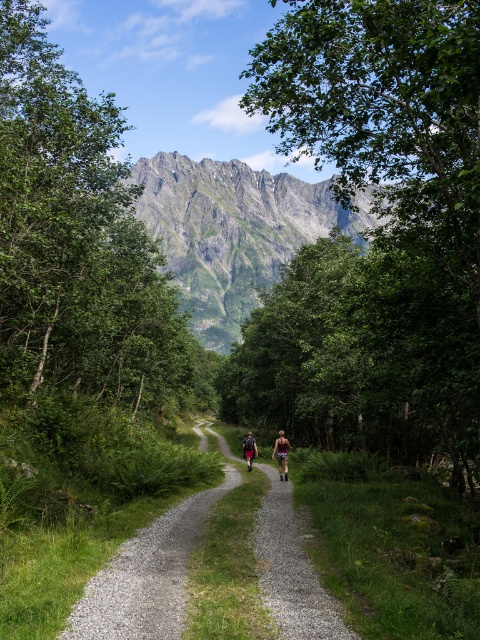
The width and height of the screenshot is (480, 640). What are the coordinates of `gravel path at center` in the screenshot? It's located at (146, 577).

Who is taller, gravel path at center or camouflage fabric shorts at center?

camouflage fabric shorts at center

Which is in front, point (326, 593) or point (272, 456)?

Point (326, 593) is more forward.

I want to click on gravel path at center, so click(146, 577).

Based on the photo, who is taller, green grassy mountain at upper center or camouflage shorts at center?

green grassy mountain at upper center is taller.

Locate an element on the screen. green grassy mountain at upper center is located at coordinates (x=233, y=230).

You are a GUI agent. You are given a task and a screenshot of the screen. Output one action in this format:
    pyautogui.click(x=<x>, y=<y>)
    Task: Click on the green grassy mountain at upper center
    
    Given the screenshot: What is the action you would take?
    pyautogui.click(x=233, y=230)

Does camouflage shorts at center have a larger size compared to camouflage fabric shorts at center?

Yes.

Between camouflage shorts at center and camouflage fabric shorts at center, which one appears on the left side from the viewer's perspective?

From the viewer's perspective, camouflage shorts at center appears more on the left side.

Does point (287, 438) come behind point (276, 438)?

No, it is in front of (276, 438).

The height and width of the screenshot is (640, 480). I want to click on camouflage shorts at center, so click(282, 452).